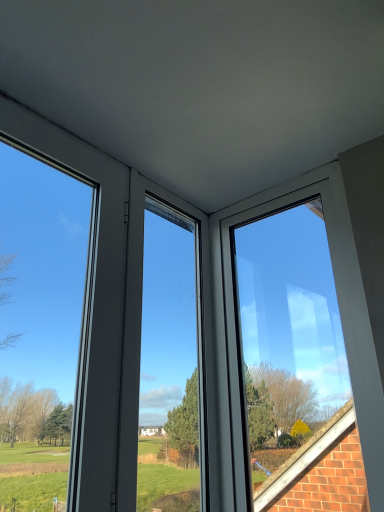
Question: From the image's perspective, is transparent glass window at left, marked as the second window in a right-to-left arrangement, located above or below transparent glass window at upper right, marked as the 1th window in a right-to-left arrangement?

Choices:
 (A) above
 (B) below

Answer: (A)

Question: Which is correct: transparent glass window at left, marked as the second window in a right-to-left arrangement, is inside transparent glass window at upper right, marked as the 1th window in a right-to-left arrangement, or outside of it?

Choices:
 (A) inside
 (B) outside

Answer: (B)

Question: From a real-world perspective, is transparent glass window at left, marked as the second window in a right-to-left arrangement, positioned above or below transparent glass window at upper right, the 2th window when ordered from left to right?

Choices:
 (A) above
 (B) below

Answer: (A)

Question: From a real-world perspective, is transparent glass window at upper right, the 2th window when ordered from left to right, physically located above or below transparent glass window at left, the first window positioned from the left?

Choices:
 (A) above
 (B) below

Answer: (B)

Question: Considering the positions of transparent glass window at upper right, the 2th window when ordered from left to right, and transparent glass window at left, marked as the second window in a right-to-left arrangement, in the image, is transparent glass window at upper right, the 2th window when ordered from left to right, wider or thinner than transparent glass window at left, marked as the second window in a right-to-left arrangement,?

Choices:
 (A) thin
 (B) wide

Answer: (B)

Question: Would you say transparent glass window at upper right, marked as the 1th window in a right-to-left arrangement, is to the left or to the right of transparent glass window at left, marked as the second window in a right-to-left arrangement, in the picture?

Choices:
 (A) left
 (B) right

Answer: (B)

Question: From the image's perspective, is transparent glass window at upper right, the 2th window when ordered from left to right, above or below transparent glass window at left, the first window positioned from the left?

Choices:
 (A) below
 (B) above

Answer: (A)